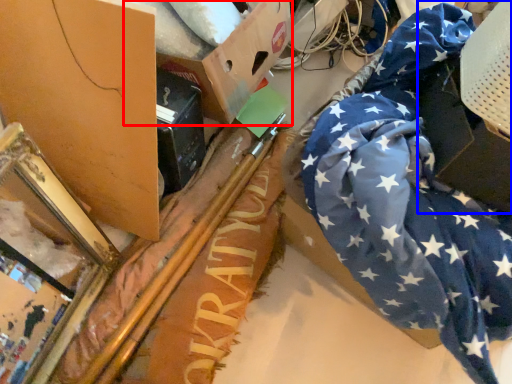
Question: Which of the following is the closest to the observer, cardboard box (highlighted by a red box) or cardboard box (highlighted by a blue box)?

Choices:
 (A) cardboard box
 (B) cardboard box

Answer: (B)